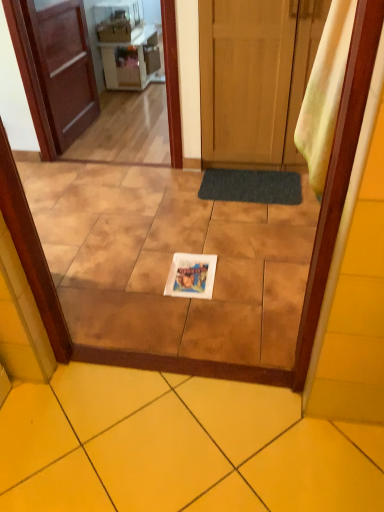
At what (x,y) coordinates should I click in order to perform the action: click on vacant point to the left of white glossy book at center. Please return your answer as a coordinate pair (x, y). This screenshot has width=384, height=512. Looking at the image, I should click on (141, 279).